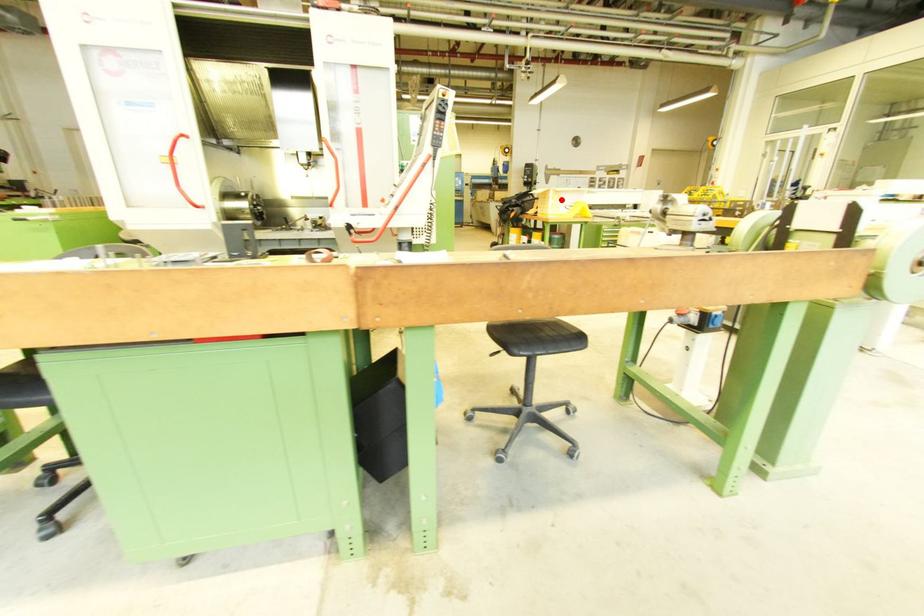
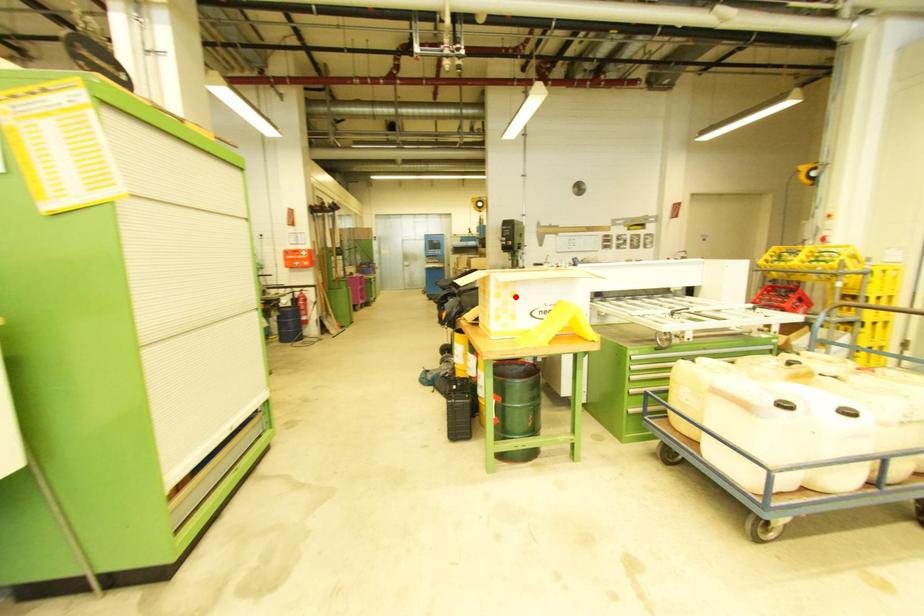
I am providing you with two images of the same scene from different viewpoints. A red point is marked on the first image and another point is marked on the second image. Are the points marked in image1 and image2 representing the same 3D position?

Yes